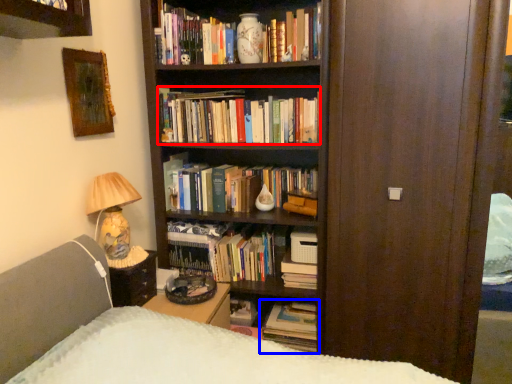
Question: Among these objects, which one is nearest to the camera, book (highlighted by a red box) or book (highlighted by a blue box)?

Choices:
 (A) book
 (B) book

Answer: (A)